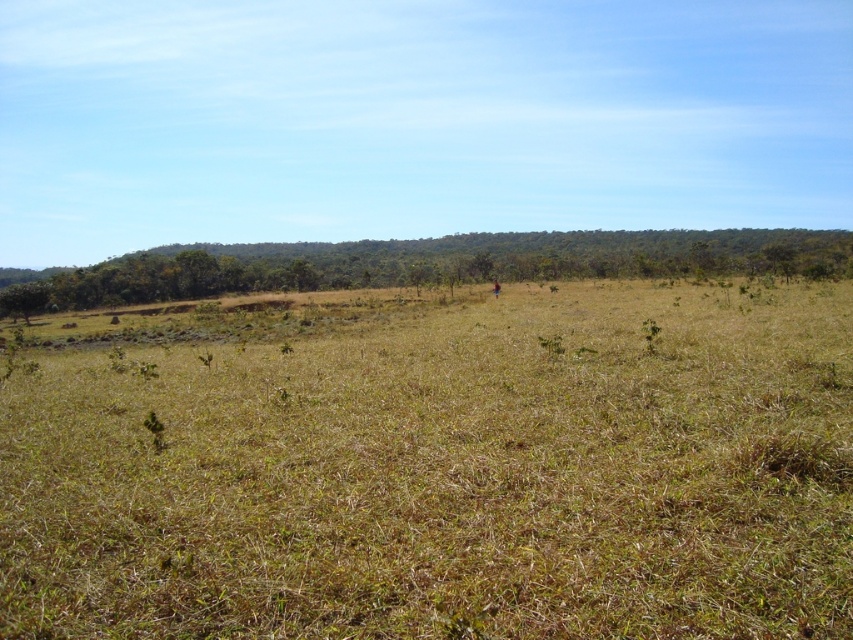
You are a bird flying over the open field and want to land on the green leafy tree at upper center. From your current position above the brown dry grass at center, which direction should you fly to reach the tree?

The brown dry grass at center is below the green leafy tree at upper center, so you should fly upward to reach the green leafy tree at upper center from the brown dry grass at center.

You are standing in the middle of the open field and want to walk towards the forest in the background. There are two points marked on the ground ahead of you. Which point, point (85, 586) or point (511, 257), is closer to you as you face the forest?

Point (85, 586) is closer to the viewer than point (511, 257), so it is the closer point.

You are standing at the origin point of the image coordinate system, which is the bottom left corner. You want to walk to the brown dry grass at center. Which direction should you move in terms of x and y coordinates?

The brown dry grass at center is located at coordinates x 0.744 and y 0.524. Since you are at the origin, you need to move right along the x axis to 0.744 and up along the y axis to 0.524 to reach it.